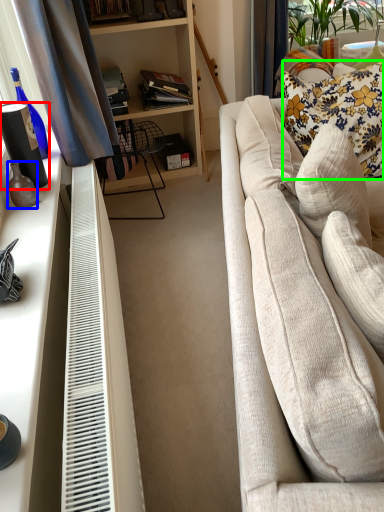
Question: Estimate the real-world distances between objects in this image. Which object is farther from vase (highlighted by a red box), bottle (highlighted by a blue box) or pillow (highlighted by a green box)?

Choices:
 (A) bottle
 (B) pillow

Answer: (B)